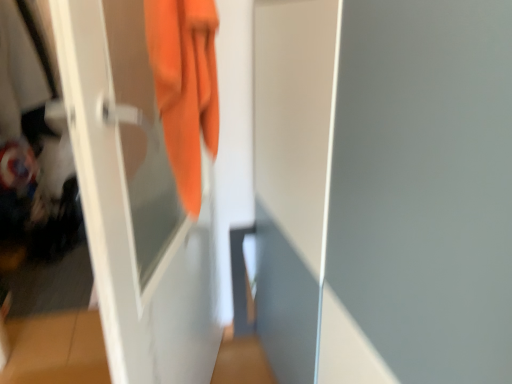
What do you see at coordinates (185, 86) in the screenshot? The height and width of the screenshot is (384, 512). I see `orange fabric towel at upper left` at bounding box center [185, 86].

Find the location of a particular element. This screenshot has height=384, width=512. white glossy screen door at left, which ranks as the second screen door in right-to-left order is located at coordinates (135, 200).

Identify the location of white glossy screen door at center, the second screen door in the left-to-right sequence. (421, 194).

Find the location of `orange fabric towel at upper left`. orange fabric towel at upper left is located at coordinates (185, 86).

Is point (169, 308) farther from camera compared to point (193, 133)?

Yes, point (169, 308) is farther from viewer.

Which is in front, white glossy screen door at left, which ranks as the second screen door in right-to-left order, or orange fabric towel at upper left?

white glossy screen door at left, which ranks as the second screen door in right-to-left order.

What are the coordinates of `towel above the white glossy screen door at left, which is counted as the 1th screen door, starting from the left (from a real-world perspective)` in the screenshot? It's located at tap(185, 86).

Could orange fabric towel at upper left be considered to be inside white glossy screen door at left, which ranks as the second screen door in right-to-left order?

Yes, white glossy screen door at left, which ranks as the second screen door in right-to-left order, is surrounding orange fabric towel at upper left.

Considering the sizes of orange fabric towel at upper left and white glossy screen door at center, which is counted as the first screen door, starting from the right, in the image, is orange fabric towel at upper left bigger or smaller than white glossy screen door at center, which is counted as the first screen door, starting from the right,?

Clearly, orange fabric towel at upper left is smaller in size than white glossy screen door at center, which is counted as the first screen door, starting from the right.

Where is `towel behind the white glossy screen door at center, the second screen door in the left-to-right sequence`? This screenshot has width=512, height=384. towel behind the white glossy screen door at center, the second screen door in the left-to-right sequence is located at coordinates (185, 86).

From the image's perspective, relative to white glossy screen door at center, which is counted as the first screen door, starting from the right, is orange fabric towel at upper left above or below?

Based on their image positions, orange fabric towel at upper left is located above white glossy screen door at center, which is counted as the first screen door, starting from the right.

Can you confirm if white glossy screen door at center, which is counted as the first screen door, starting from the right, is shorter than white glossy screen door at left, which is counted as the 1th screen door, starting from the left?

No, white glossy screen door at center, which is counted as the first screen door, starting from the right, is not shorter than white glossy screen door at left, which is counted as the 1th screen door, starting from the left.

Which object is closer to the camera taking this photo, white glossy screen door at center, the second screen door in the left-to-right sequence, or white glossy screen door at left, which is counted as the 1th screen door, starting from the left?

white glossy screen door at center, the second screen door in the left-to-right sequence, is in front.

Are white glossy screen door at center, the second screen door in the left-to-right sequence, and white glossy screen door at left, which ranks as the second screen door in right-to-left order, beside each other?

No, white glossy screen door at center, the second screen door in the left-to-right sequence, is not making contact with white glossy screen door at left, which ranks as the second screen door in right-to-left order.

Considering the relative sizes of white glossy screen door at center, which is counted as the first screen door, starting from the right, and white glossy screen door at left, which is counted as the 1th screen door, starting from the left, in the image provided, is white glossy screen door at center, which is counted as the first screen door, starting from the right, wider than white glossy screen door at left, which is counted as the 1th screen door, starting from the left,?

Yes.

Based on the photo, from a real-world perspective, is white glossy screen door at left, which is counted as the 1th screen door, starting from the left, physically below white glossy screen door at center, the second screen door in the left-to-right sequence?

Incorrect, from a real-world perspective, white glossy screen door at left, which is counted as the 1th screen door, starting from the left, is higher than white glossy screen door at center, the second screen door in the left-to-right sequence.

Which of these two, white glossy screen door at left, which is counted as the 1th screen door, starting from the left, or white glossy screen door at center, the second screen door in the left-to-right sequence, stands shorter?

With less height is white glossy screen door at left, which is counted as the 1th screen door, starting from the left.

Between point (185, 321) and point (342, 183), which one is positioned in front?

The point (342, 183) is closer to the camera.

Would you say white glossy screen door at center, which is counted as the first screen door, starting from the right, contains orange fabric towel at upper left?

No, orange fabric towel at upper left is not inside white glossy screen door at center, which is counted as the first screen door, starting from the right.

From a real-world perspective, between white glossy screen door at center, the second screen door in the left-to-right sequence, and orange fabric towel at upper left, who is vertically higher?

orange fabric towel at upper left is physically above.

Which is more to the right, white glossy screen door at center, the second screen door in the left-to-right sequence, or orange fabric towel at upper left?

white glossy screen door at center, the second screen door in the left-to-right sequence.

Consider the image. Does white glossy screen door at center, which is counted as the first screen door, starting from the right, have a greater height compared to orange fabric towel at upper left?

Yes.

From a real-world perspective, is orange fabric towel at upper left over white glossy screen door at left, which is counted as the 1th screen door, starting from the left?

Indeed, from a real-world perspective, orange fabric towel at upper left stands above white glossy screen door at left, which is counted as the 1th screen door, starting from the left.

Is the position of orange fabric towel at upper left more distant than that of white glossy screen door at left, which is counted as the 1th screen door, starting from the left?

Yes, orange fabric towel at upper left is further from the viewer.

From the image's perspective, which object appears higher, orange fabric towel at upper left or white glossy screen door at left, which ranks as the second screen door in right-to-left order?

orange fabric towel at upper left is shown above in the image.

Is point (190, 88) in front of point (90, 203)?

No, (190, 88) is further to viewer.

I want to click on the 1st screen door in front of the orange fabric towel at upper left, so click(135, 200).

The width and height of the screenshot is (512, 384). I want to click on towel lying on the left of white glossy screen door at center, the second screen door in the left-to-right sequence, so click(x=185, y=86).

Which object lies nearer to the anchor point white glossy screen door at left, which ranks as the second screen door in right-to-left order, white glossy screen door at center, which is counted as the first screen door, starting from the right, or orange fabric towel at upper left?

orange fabric towel at upper left is closer to white glossy screen door at left, which ranks as the second screen door in right-to-left order.

When comparing their distances from orange fabric towel at upper left, does white glossy screen door at left, which is counted as the 1th screen door, starting from the left, or white glossy screen door at center, which is counted as the first screen door, starting from the right, seem further?

white glossy screen door at center, which is counted as the first screen door, starting from the right.

Considering their positions, is white glossy screen door at center, which is counted as the first screen door, starting from the right, positioned further to orange fabric towel at upper left than white glossy screen door at left, which ranks as the second screen door in right-to-left order?

white glossy screen door at center, which is counted as the first screen door, starting from the right, is further to orange fabric towel at upper left.

From the image, which object appears to be farther from white glossy screen door at center, the second screen door in the left-to-right sequence, orange fabric towel at upper left or white glossy screen door at left, which is counted as the 1th screen door, starting from the left?

The object further to white glossy screen door at center, the second screen door in the left-to-right sequence, is white glossy screen door at left, which is counted as the 1th screen door, starting from the left.

From the image, which object appears to be nearer to white glossy screen door at left, which ranks as the second screen door in right-to-left order, orange fabric towel at upper left or white glossy screen door at center, which is counted as the first screen door, starting from the right?

The object closer to white glossy screen door at left, which ranks as the second screen door in right-to-left order, is orange fabric towel at upper left.

Estimate the real-world distances between objects in this image. Which object is further from white glossy screen door at center, the second screen door in the left-to-right sequence, white glossy screen door at left, which ranks as the second screen door in right-to-left order, or orange fabric towel at upper left?

white glossy screen door at left, which ranks as the second screen door in right-to-left order, is further to white glossy screen door at center, the second screen door in the left-to-right sequence.

At what (x,y) coordinates should I click in order to perform the action: click on towel between white glossy screen door at left, which ranks as the second screen door in right-to-left order, and white glossy screen door at center, which is counted as the first screen door, starting from the right, from left to right. Please return your answer as a coordinate pair (x, y). Looking at the image, I should click on (185, 86).